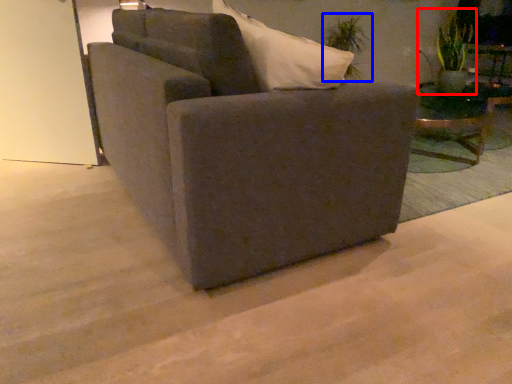
Question: Which object is closer to the camera taking this photo, plant (highlighted by a red box) or plant (highlighted by a blue box)?

Choices:
 (A) plant
 (B) plant

Answer: (A)